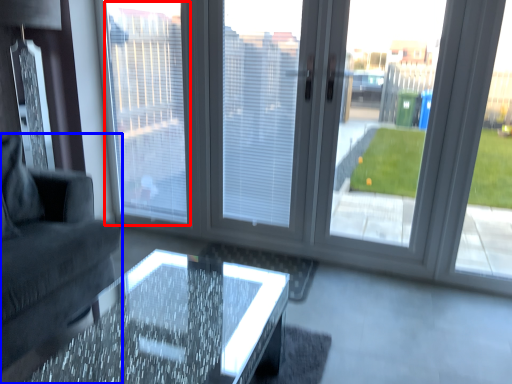
Question: Which of the following is the farthest to the observer, window screen (highlighted by a red box) or studio couch (highlighted by a blue box)?

Choices:
 (A) window screen
 (B) studio couch

Answer: (A)